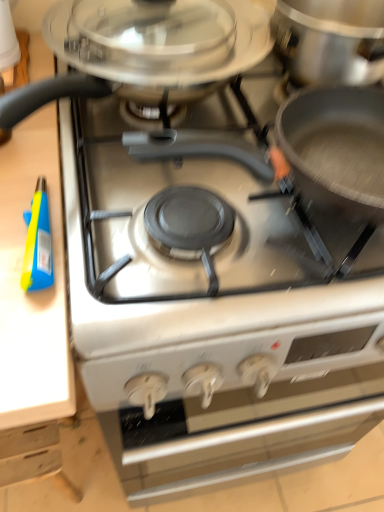
Question: Does satin silver cooktop at center have a smaller size compared to blue plastic spray bottle at left?

Choices:
 (A) yes
 (B) no

Answer: (B)

Question: Is satin silver cooktop at center at the left side of blue plastic spray bottle at left?

Choices:
 (A) yes
 (B) no

Answer: (B)

Question: Is satin silver cooktop at center to the right of blue plastic spray bottle at left from the viewer's perspective?

Choices:
 (A) yes
 (B) no

Answer: (A)

Question: Can you confirm if satin silver cooktop at center is shorter than blue plastic spray bottle at left?

Choices:
 (A) no
 (B) yes

Answer: (A)

Question: Is satin silver cooktop at center closer to the viewer compared to blue plastic spray bottle at left?

Choices:
 (A) yes
 (B) no

Answer: (A)

Question: Can you confirm if satin silver cooktop at center is thinner than blue plastic spray bottle at left?

Choices:
 (A) no
 (B) yes

Answer: (A)

Question: Does blue plastic spray bottle at left appear on the right side of white matte oven at center?

Choices:
 (A) yes
 (B) no

Answer: (B)

Question: Can you confirm if blue plastic spray bottle at left is positioned to the left of white matte oven at center?

Choices:
 (A) no
 (B) yes

Answer: (B)

Question: Is blue plastic spray bottle at left shorter than white matte oven at center?

Choices:
 (A) yes
 (B) no

Answer: (A)

Question: From a real-world perspective, is blue plastic spray bottle at left located beneath white matte oven at center?

Choices:
 (A) yes
 (B) no

Answer: (B)

Question: Is the surface of blue plastic spray bottle at left in direct contact with white matte oven at center?

Choices:
 (A) no
 (B) yes

Answer: (A)

Question: From the image's perspective, is blue plastic spray bottle at left on white matte oven at center?

Choices:
 (A) yes
 (B) no

Answer: (A)

Question: Is satin silver cooktop at center at the back of white matte oven at center?

Choices:
 (A) no
 (B) yes

Answer: (A)